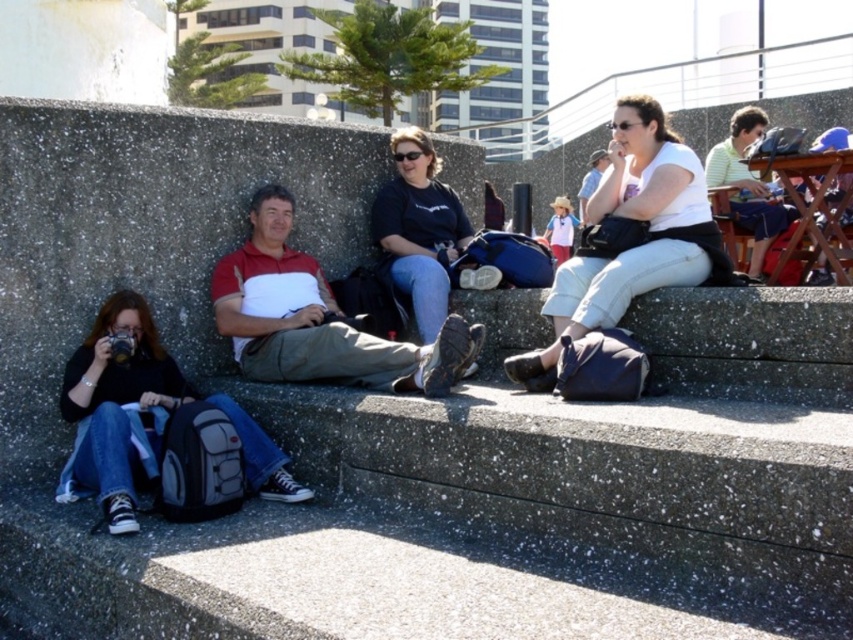
Which is above, denim jeans at lower left or black matte shirt at center?

black matte shirt at center is higher up.

Can you confirm if denim jeans at lower left is positioned below black matte shirt at center?

Correct, denim jeans at lower left is located below black matte shirt at center.

Who is more distant from viewer, (152,480) or (393,209)?

Positioned behind is point (393,209).

The width and height of the screenshot is (853, 640). In order to click on denim jeans at lower left in this screenshot , I will do `click(143, 417)`.

This screenshot has width=853, height=640. What do you see at coordinates (631, 234) in the screenshot?
I see `white matte shirt at upper right` at bounding box center [631, 234].

Is the position of white matte shirt at upper right less distant than that of matte white shirt at center?

Yes, it is in front of matte white shirt at center.

What do you see at coordinates (631, 234) in the screenshot?
I see `white matte shirt at upper right` at bounding box center [631, 234].

Image resolution: width=853 pixels, height=640 pixels. What are the coordinates of `white matte shirt at upper right` in the screenshot? It's located at (631, 234).

Is the position of denim jeans at lower left more distant than that of matte white shirt at center?

No, denim jeans at lower left is closer to the viewer.

Which is above, denim jeans at lower left or matte white shirt at center?

Positioned higher is matte white shirt at center.

This screenshot has width=853, height=640. What are the coordinates of `denim jeans at lower left` in the screenshot? It's located at (143, 417).

Image resolution: width=853 pixels, height=640 pixels. In order to click on denim jeans at lower left in this screenshot , I will do `click(143, 417)`.